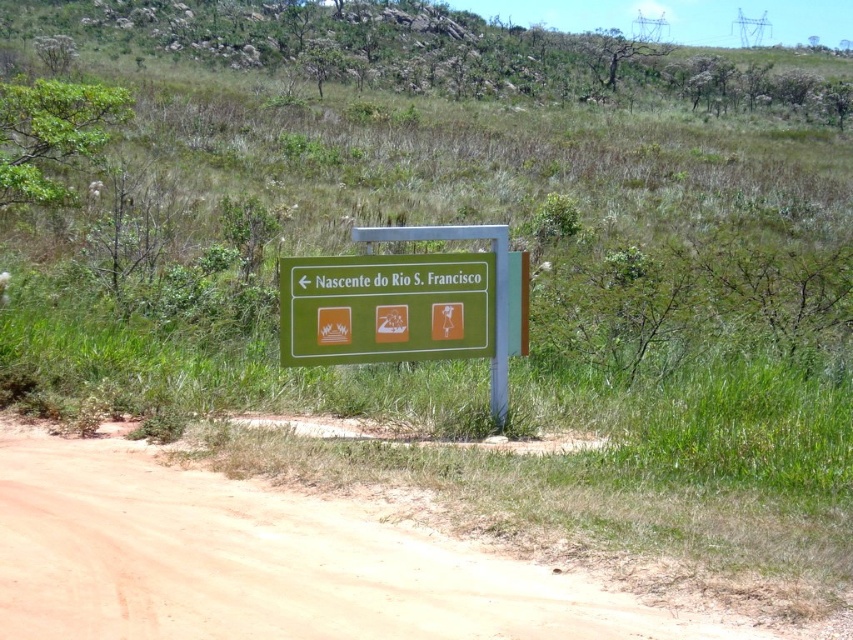
Between green plastic sign at center and green matte sign at center, which one is positioned lower?

green plastic sign at center

Which is behind, point (352, 259) or point (310, 282)?

The point (352, 259) is more distant.

Who is more forward, (331, 349) or (299, 298)?

Point (299, 298) is more forward.

This screenshot has width=853, height=640. I want to click on green plastic sign at center, so click(401, 305).

Between brown sandy dirt track at lower left and green matte sign at center, which one is positioned lower?

brown sandy dirt track at lower left is below.

Can you confirm if brown sandy dirt track at lower left is positioned above green matte sign at center?

Incorrect, brown sandy dirt track at lower left is not positioned above green matte sign at center.

Does point (102, 611) come in front of point (296, 273)?

That is True.

You are a GUI agent. You are given a task and a screenshot of the screen. Output one action in this format:
    pyautogui.click(x=<x>, y=<y>)
    Task: Click on the brown sandy dirt track at lower left
    This screenshot has width=853, height=640.
    Given the screenshot: What is the action you would take?
    pyautogui.click(x=265, y=561)

Does brown sandy dirt track at lower left lie in front of green plastic sign at center?

Yes, brown sandy dirt track at lower left is closer to the viewer.

Which is below, brown sandy dirt track at lower left or green plastic sign at center?

brown sandy dirt track at lower left

Between point (49, 472) and point (381, 317), which one is positioned behind?

Point (381, 317)

Locate an element on the screen. This screenshot has width=853, height=640. brown sandy dirt track at lower left is located at coordinates (265, 561).